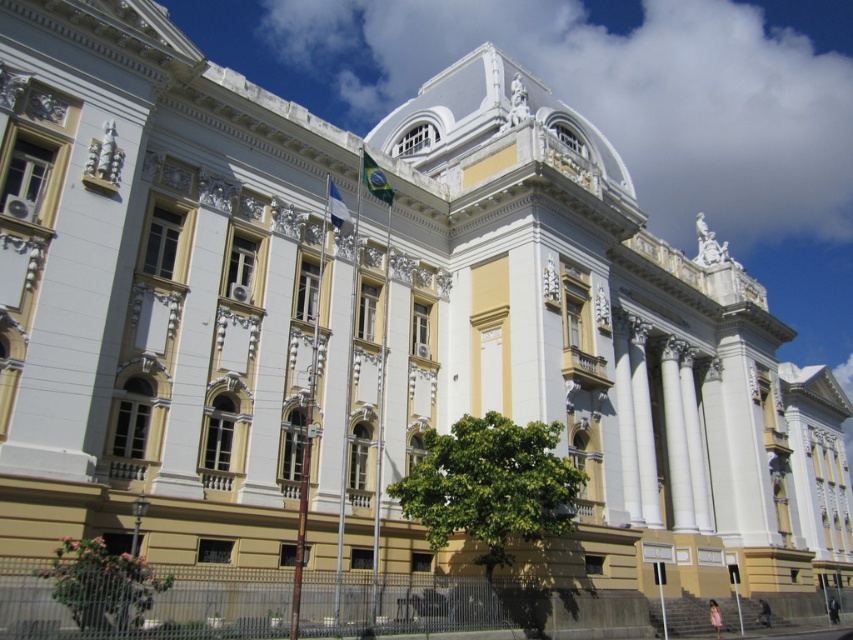
You are standing in front of the grand neoclassical building and want to take a photo that includes both the green leafy tree at center and the green leafy tree at lower left. Which tree should you position closer to the front of the photo to ensure both are visible without cropping?

The green leafy tree at lower left should be positioned closer to the front of the photo because it is shorter than the green leafy tree at center, allowing both to fit within the frame without cropping.